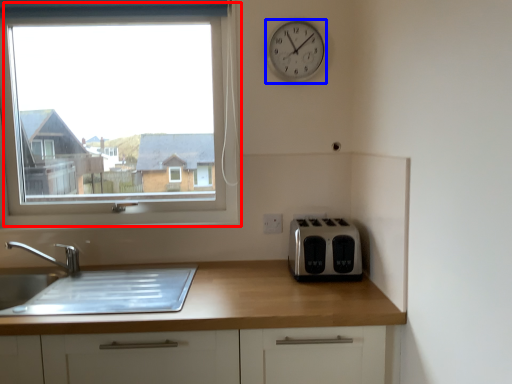
Question: Which object appears farthest to the camera in this image, window (highlighted by a red box) or clock (highlighted by a blue box)?

Choices:
 (A) window
 (B) clock

Answer: (A)